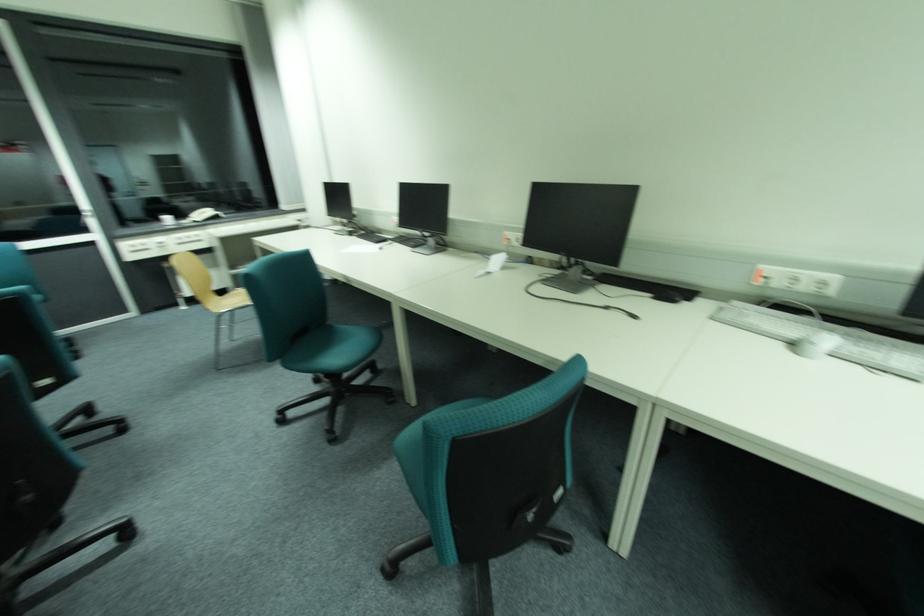
Where is `wooden chair sitting surface`? This screenshot has width=924, height=616. wooden chair sitting surface is located at coordinates (234, 301).